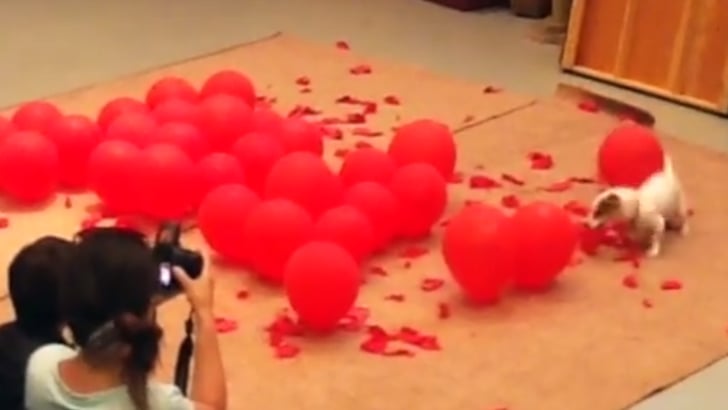
Where is `temporary flooring panels`? temporary flooring panels is located at coordinates (542, 132), (461, 96).